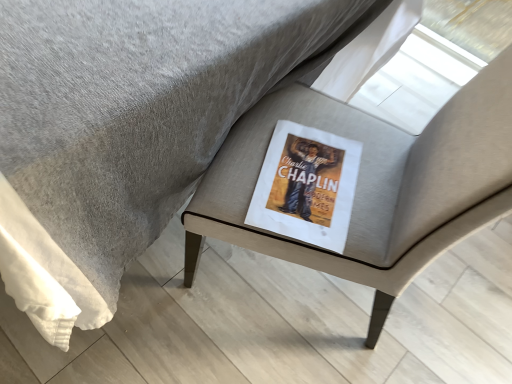
You are a GUI agent. You are given a task and a screenshot of the screen. Output one action in this format:
    pyautogui.click(x=<x>, y=<y>)
    Task: Click on the blank area beneath matte gray cushion at center (from a real-world perspective)
    The width and height of the screenshot is (512, 384).
    Given the screenshot: What is the action you would take?
    pyautogui.click(x=301, y=292)